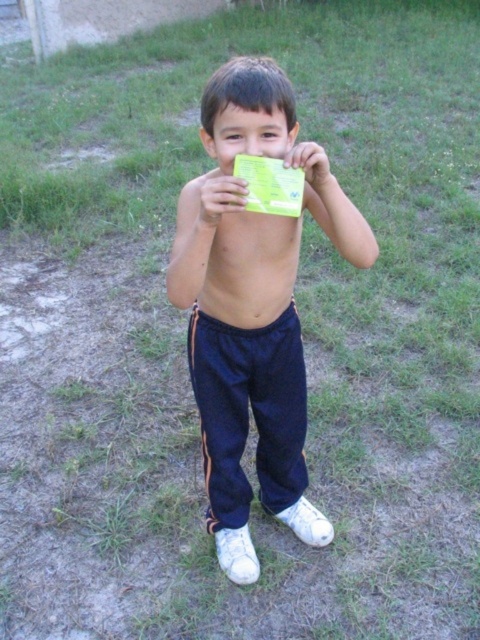
Question: Does navy blue track pants at center come behind smooth skin face at center?

Choices:
 (A) no
 (B) yes

Answer: (A)

Question: Does navy blue track pants at center have a greater width compared to smooth skin face at center?

Choices:
 (A) no
 (B) yes

Answer: (B)

Question: Is navy blue track pants at center thinner than smooth skin face at center?

Choices:
 (A) yes
 (B) no

Answer: (B)

Question: Which of the following is the closest to the observer?

Choices:
 (A) smooth skin face at center
 (B) navy blue track pants at center

Answer: (B)

Question: Among these objects, which one is farthest from the camera?

Choices:
 (A) navy blue track pants at center
 (B) smooth skin face at center

Answer: (B)

Question: Which point is farther to the camera?

Choices:
 (A) navy blue track pants at center
 (B) smooth skin face at center

Answer: (B)